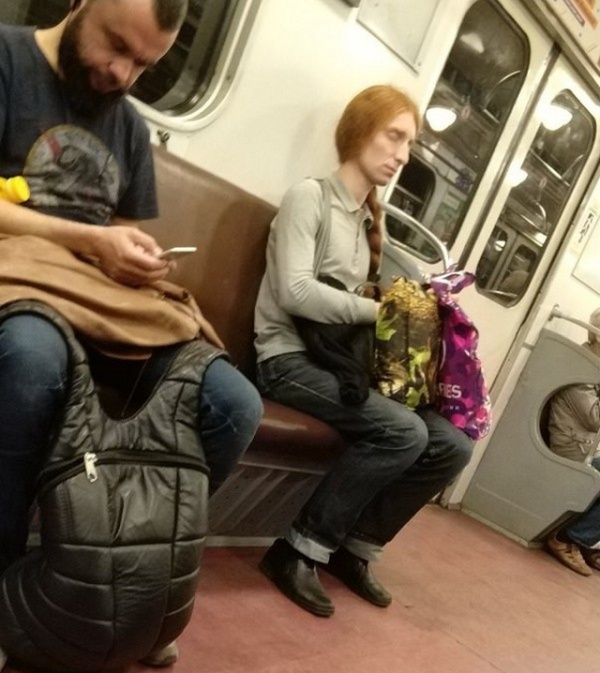
Where is `brown bench`? brown bench is located at coordinates (227, 262).